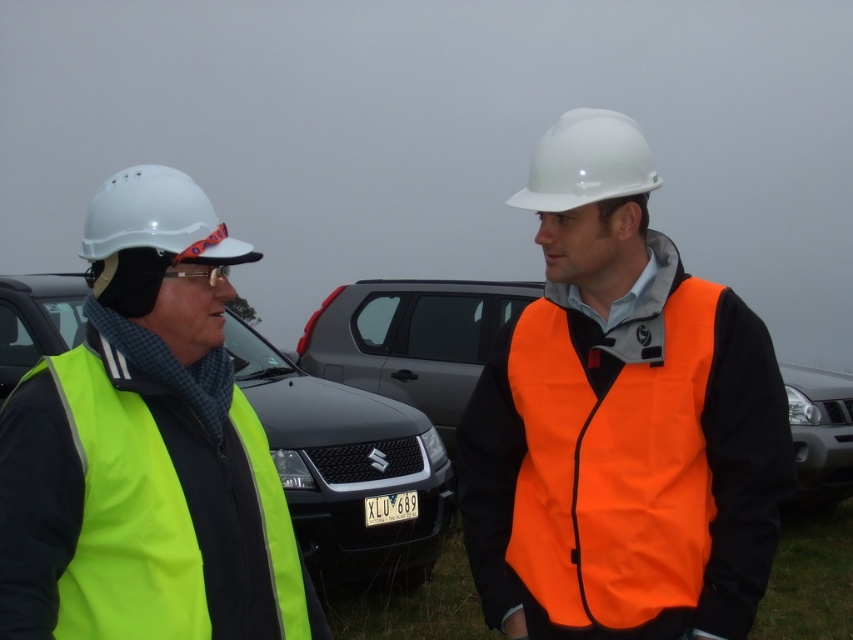
You are a drone operator trying to capture a photo of two points in the scene. The first point is labeled as point [693,403] and the second is point [804,490]. Which point should you focus on first if you want to ensure both points are in focus without adjusting the camera settings?

You should focus on point [693,403] first because it is closer to the camera than point [804,490]. By focusing on the closer point, the farther point will still be within the depth of field, ensuring both are in focus without needing to adjust the camera settings.